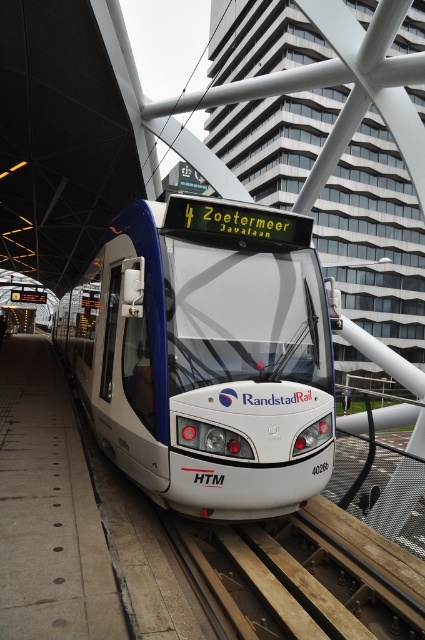
Is white glossy train at center smaller than brown wooden train track at lower center?

Actually, white glossy train at center might be larger than brown wooden train track at lower center.

Is point (192, 236) farther from camera compared to point (320, 516)?

That is False.

Image resolution: width=425 pixels, height=640 pixels. In order to click on white glossy train at center in this screenshot , I will do `click(206, 355)`.

This screenshot has height=640, width=425. I want to click on white glossy train at center, so [206, 355].